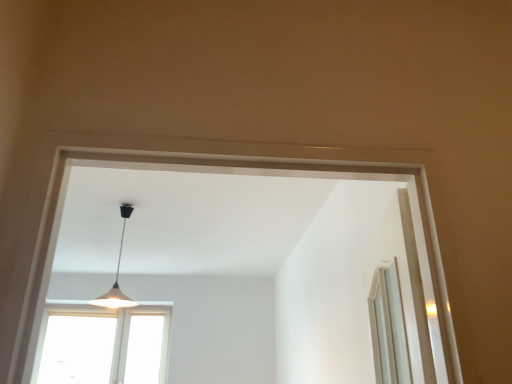
Question: Is transparent glass window at lower left closer to the viewer compared to white matte lampshade at center?

Choices:
 (A) yes
 (B) no

Answer: (B)

Question: Is white matte lampshade at center a part of transparent glass window at lower left?

Choices:
 (A) no
 (B) yes

Answer: (A)

Question: From the image's perspective, is transparent glass window at lower left on top of white matte lampshade at center?

Choices:
 (A) yes
 (B) no

Answer: (B)

Question: Does transparent glass window at lower left turn towards white matte lampshade at center?

Choices:
 (A) no
 (B) yes

Answer: (B)

Question: Does transparent glass window at lower left have a greater height compared to white matte lampshade at center?

Choices:
 (A) no
 (B) yes

Answer: (B)

Question: Is transparent glass window at lower left positioned behind white matte lampshade at center?

Choices:
 (A) no
 (B) yes

Answer: (B)

Question: Can you confirm if white matte lampshade at center is taller than transparent glass window at lower left?

Choices:
 (A) no
 (B) yes

Answer: (A)

Question: Considering the relative positions of white matte lampshade at center and transparent glass window at lower left in the image provided, is white matte lampshade at center to the right of transparent glass window at lower left from the viewer's perspective?

Choices:
 (A) no
 (B) yes

Answer: (B)

Question: Does white matte lampshade at center come in front of transparent glass window at lower left?

Choices:
 (A) yes
 (B) no

Answer: (A)

Question: Considering the relative sizes of white matte lampshade at center and transparent glass window at lower left in the image provided, is white matte lampshade at center thinner than transparent glass window at lower left?

Choices:
 (A) no
 (B) yes

Answer: (A)

Question: From the image's perspective, is white matte lampshade at center located above transparent glass window at lower left?

Choices:
 (A) no
 (B) yes

Answer: (B)

Question: Is white matte lampshade at center not inside transparent glass window at lower left?

Choices:
 (A) yes
 (B) no

Answer: (A)

Question: Based on their positions, is transparent glass window at lower left located to the left or right of white matte lampshade at center?

Choices:
 (A) right
 (B) left

Answer: (B)